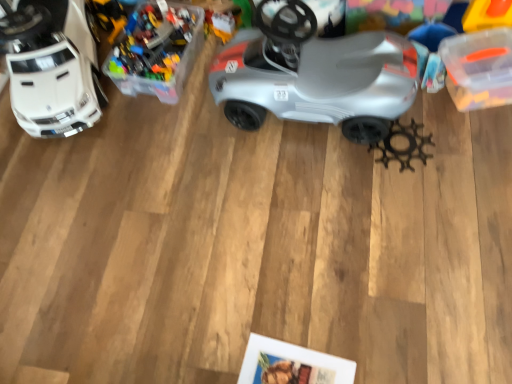
Question: Is white plastic car at left, the 1th toy when ordered from left to right, oriented away from metallic gear at lower right, the 3th toy viewed from the left?

Choices:
 (A) yes
 (B) no

Answer: (B)

Question: Can you confirm if white plastic car at left, the 1th toy when ordered from left to right, is positioned to the left of metallic gear at lower right, the 3th toy viewed from the left?

Choices:
 (A) no
 (B) yes

Answer: (B)

Question: Are white plastic car at left, the 1th toy when ordered from left to right, and metallic gear at lower right, which is the 1th toy in right-to-left order, located far from each other?

Choices:
 (A) no
 (B) yes

Answer: (B)

Question: Are white plastic car at left, the 1th toy when ordered from left to right, and metallic gear at lower right, which is the 1th toy in right-to-left order, making contact?

Choices:
 (A) yes
 (B) no

Answer: (B)

Question: From the image's perspective, would you say white plastic car at left, the 3th toy in the right-to-left sequence, is shown under metallic gear at lower right, which is the 1th toy in right-to-left order?

Choices:
 (A) yes
 (B) no

Answer: (B)

Question: Considering the positions of white plastic car at left, the 1th toy when ordered from left to right, and silver matte car at center in the image, is white plastic car at left, the 1th toy when ordered from left to right, taller or shorter than silver matte car at center?

Choices:
 (A) short
 (B) tall

Answer: (A)

Question: Is white plastic car at left, the 3th toy in the right-to-left sequence, wider or thinner than silver matte car at center?

Choices:
 (A) thin
 (B) wide

Answer: (B)

Question: Is point (60, 96) closer or farther from the camera than point (390, 36)?

Choices:
 (A) closer
 (B) farther

Answer: (A)

Question: Is white plastic car at left, the 1th toy when ordered from left to right, situated inside silver matte car at center or outside?

Choices:
 (A) outside
 (B) inside

Answer: (A)

Question: From the image's perspective, is translucent plastic container at upper left, acting as the second toy starting from the left, above or below metallic gear at lower right, the 3th toy viewed from the left?

Choices:
 (A) above
 (B) below

Answer: (A)

Question: In terms of height, does translucent plastic container at upper left, the 2th toy positioned from the right, look taller or shorter compared to metallic gear at lower right, the 3th toy viewed from the left?

Choices:
 (A) tall
 (B) short

Answer: (A)

Question: Is point (167, 76) closer or farther from the camera than point (406, 155)?

Choices:
 (A) farther
 (B) closer

Answer: (A)

Question: Which is correct: translucent plastic container at upper left, the 2th toy positioned from the right, is inside metallic gear at lower right, the 3th toy viewed from the left, or outside of it?

Choices:
 (A) inside
 (B) outside

Answer: (B)

Question: Considering their positions, is translucent plastic container at upper left, acting as the second toy starting from the left, located in front of or behind white plastic car at left, the 1th toy when ordered from left to right?

Choices:
 (A) behind
 (B) front

Answer: (A)

Question: From a real-world perspective, is translucent plastic container at upper left, acting as the second toy starting from the left, positioned above or below white plastic car at left, the 3th toy in the right-to-left sequence?

Choices:
 (A) below
 (B) above

Answer: (A)